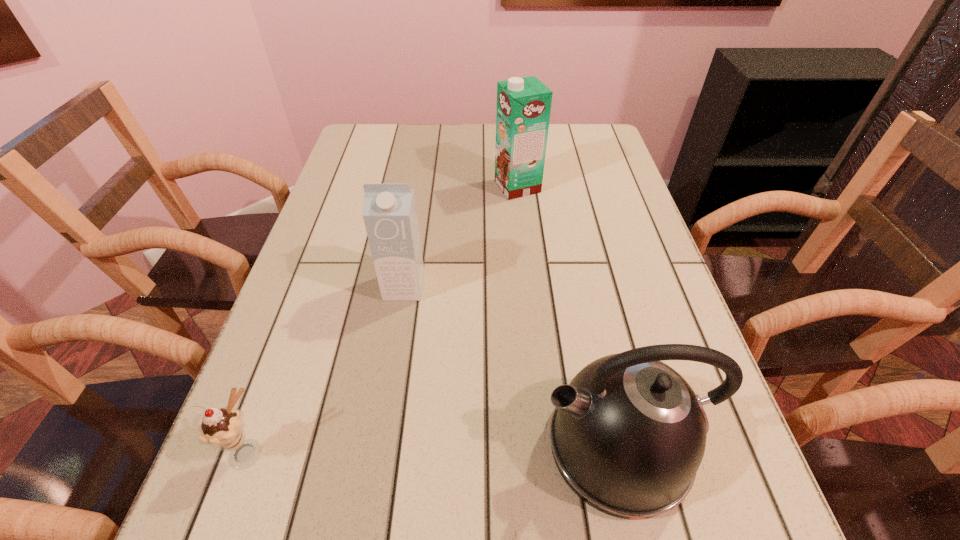
Where is `vacant space in between the farther carton and the shortest object`? vacant space in between the farther carton and the shortest object is located at coordinates (382, 319).

At what (x,y) coordinates should I click in order to perform the action: click on free space that is in between the second object from left to right and the right carton. Please return your answer as a coordinate pair (x, y). This screenshot has width=960, height=540. Looking at the image, I should click on click(461, 237).

Where is `free point between the farther carton and the kettle`? The height and width of the screenshot is (540, 960). free point between the farther carton and the kettle is located at coordinates click(568, 316).

Locate an element on the screen. The height and width of the screenshot is (540, 960). vacant space that's between the nearer carton and the farther carton is located at coordinates (461, 237).

You are a GUI agent. You are given a task and a screenshot of the screen. Output one action in this format:
    pyautogui.click(x=<x>, y=<y>)
    Task: Click on the unoccupied position between the leftmost object and the third nearest object
    
    Given the screenshot: What is the action you would take?
    pyautogui.click(x=325, y=369)

The image size is (960, 540). What are the coordinates of `free space between the kettle and the leftmost object` in the screenshot? It's located at tap(433, 448).

The height and width of the screenshot is (540, 960). I want to click on free space between the kettle and the icecream, so click(x=433, y=448).

At what (x,y) coordinates should I click in order to perform the action: click on vacant area that lies between the right carton and the third nearest object. Please return your answer as a coordinate pair (x, y). Image resolution: width=960 pixels, height=540 pixels. Looking at the image, I should click on (461, 237).

Locate an element on the screen. This screenshot has width=960, height=540. free space between the farthest object and the nearer carton is located at coordinates (461, 237).

I want to click on free point between the shortest object and the nearer carton, so click(325, 369).